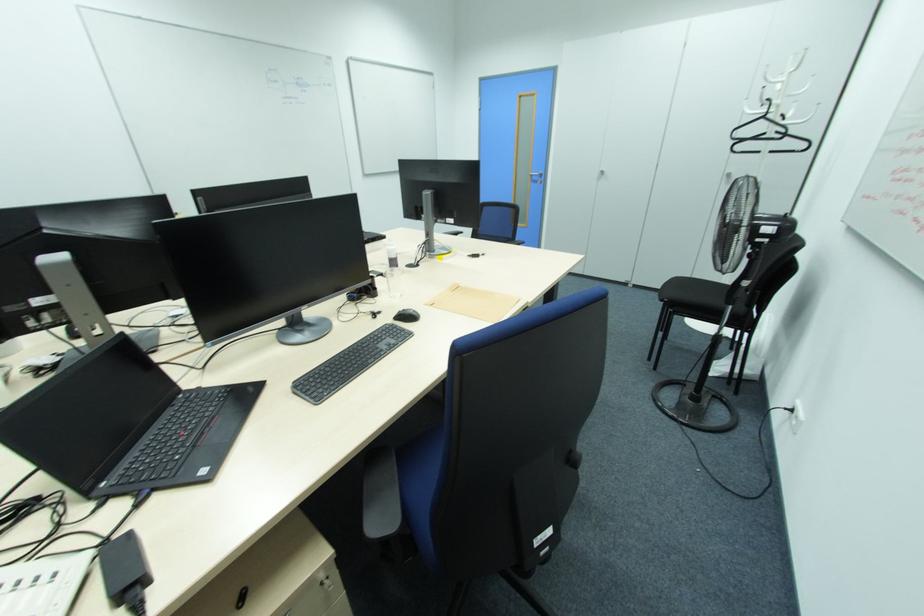
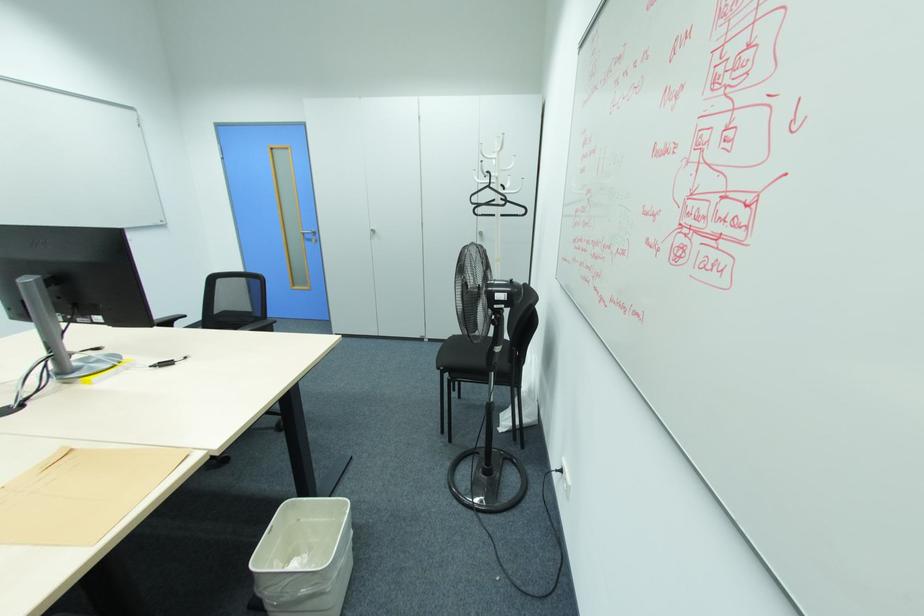
In the second image, find the point that corresponds to the point at 667,301 in the first image.

(442, 369)